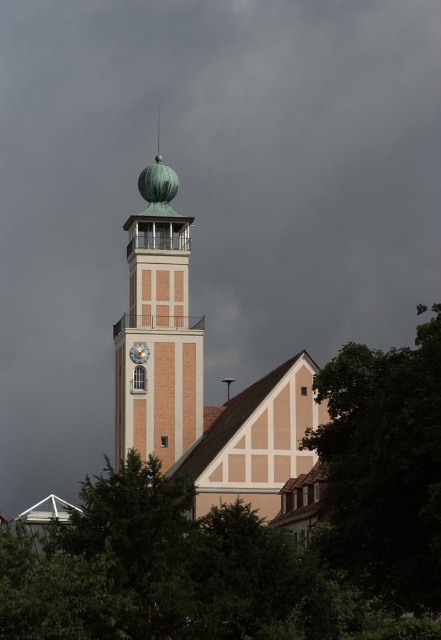
You are a maintenance worker needing to reach the metallic dome at center and the gold metallic clock at center for inspection. Which object is taller and requires a taller ladder?

The metallic dome at center is much taller than the gold metallic clock at center, so you need a taller ladder to reach the metallic dome at center.

You are standing in front of the clock tower and want to take a photo that includes both the gold metallic clock at center and the green leafy tree at lower right. Given their sizes, which object should you frame closer to the edge of the photo to ensure both are visible?

The gold metallic clock at center is smaller than the green leafy tree at lower right, so you should frame the gold metallic clock at center closer to the edge of the photo to ensure both are visible.